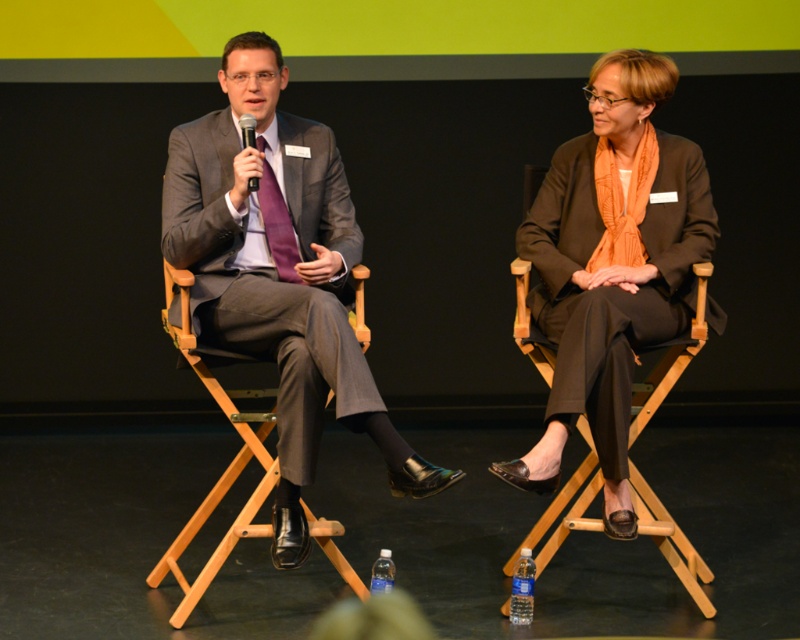
Question: Does matte gray suit at left have a lesser width compared to purple satin tie at left?

Choices:
 (A) no
 (B) yes

Answer: (A)

Question: Which object is farther from the camera taking this photo?

Choices:
 (A) purple satin tie at left
 (B) matte gray suit at left
 (C) wooden chair at right

Answer: (A)

Question: Is wooden chair at right above black plastic microphone at center?

Choices:
 (A) no
 (B) yes

Answer: (A)

Question: Which object appears farthest from the camera in this image?

Choices:
 (A) wooden chair at center
 (B) purple satin tie at left
 (C) matte black suit at right
 (D) black plastic microphone at center

Answer: (B)

Question: Which point is closer to the camera?

Choices:
 (A) matte black suit at right
 (B) black plastic microphone at center
 (C) matte gray suit at left

Answer: (C)

Question: Is wooden chair at center further to camera compared to black plastic microphone at center?

Choices:
 (A) yes
 (B) no

Answer: (B)